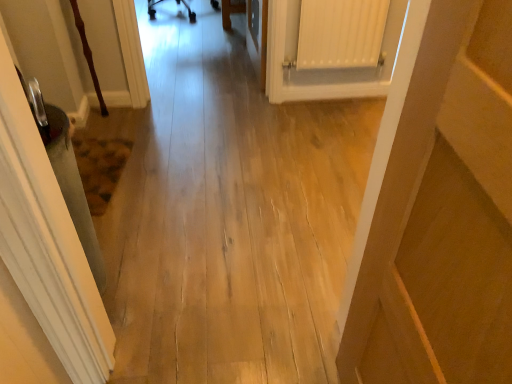
Where is `free point below white matte radiator at upper right (from a real-world perspective)`? free point below white matte radiator at upper right (from a real-world perspective) is located at coordinates (320, 96).